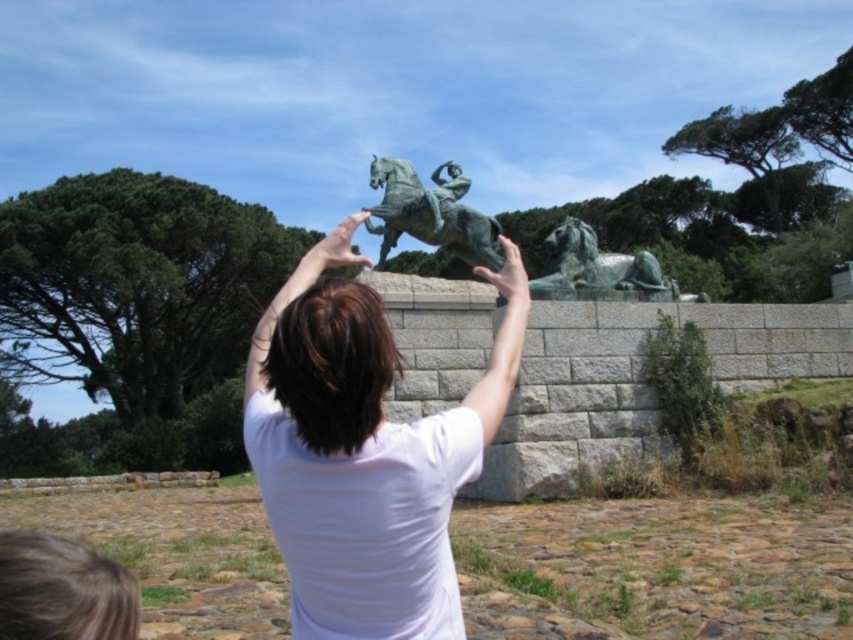
Question: Which object appears closest to the camera in this image?

Choices:
 (A) white matte shirt at center
 (B) green polished bronze horseman at center
 (C) green polished stone horse at right

Answer: (A)

Question: Where is white matte shirt at center located in relation to green polished stone horse at right in the image?

Choices:
 (A) right
 (B) left

Answer: (B)

Question: Does white matte shirt at center have a lesser width compared to green polished bronze horseman at center?

Choices:
 (A) yes
 (B) no

Answer: (A)

Question: Which point appears farthest from the camera in this image?

Choices:
 (A) (668, 292)
 (B) (396, 508)
 (C) (397, 195)

Answer: (C)

Question: Which point is farther from the camera taking this photo?

Choices:
 (A) (469, 257)
 (B) (555, 246)
 (C) (318, 529)

Answer: (A)

Question: Is white matte shirt at center to the right of green polished stone horse at right from the viewer's perspective?

Choices:
 (A) no
 (B) yes

Answer: (A)